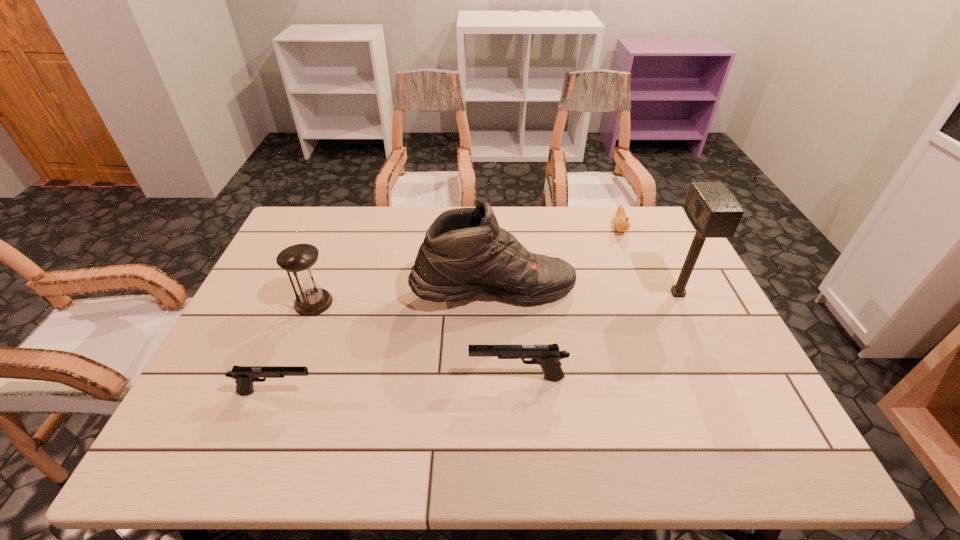
Locate an element on the screen. free space located at the aiming end of the taller gun is located at coordinates (414, 377).

Where is `vacant space positioned 0.080m at the aiming end of the taller gun`? vacant space positioned 0.080m at the aiming end of the taller gun is located at coordinates (436, 377).

Locate an element on the screen. free space located at the aiming end of the taller gun is located at coordinates (329, 377).

This screenshot has height=540, width=960. Identify the location of free location located on the left of the fifth object from left to right. (547, 228).

In order to click on vacant space positioned 0.110m on the front of the ski boot in this screenshot , I will do `click(495, 348)`.

The image size is (960, 540). What are the coordinates of `vacant region located on the right of the fourth shortest object` in the screenshot? It's located at (354, 303).

Locate an element on the screen. Image resolution: width=960 pixels, height=540 pixels. free space located on the back of the mallet is located at coordinates (653, 242).

Locate an element on the screen. Image resolution: width=960 pixels, height=540 pixels. object present at the far edge is located at coordinates (621, 220).

Where is `object that is at the near edge`? This screenshot has height=540, width=960. object that is at the near edge is located at coordinates (244, 376).

The height and width of the screenshot is (540, 960). What are the coordinates of `gun that is at the left edge` in the screenshot? It's located at (244, 376).